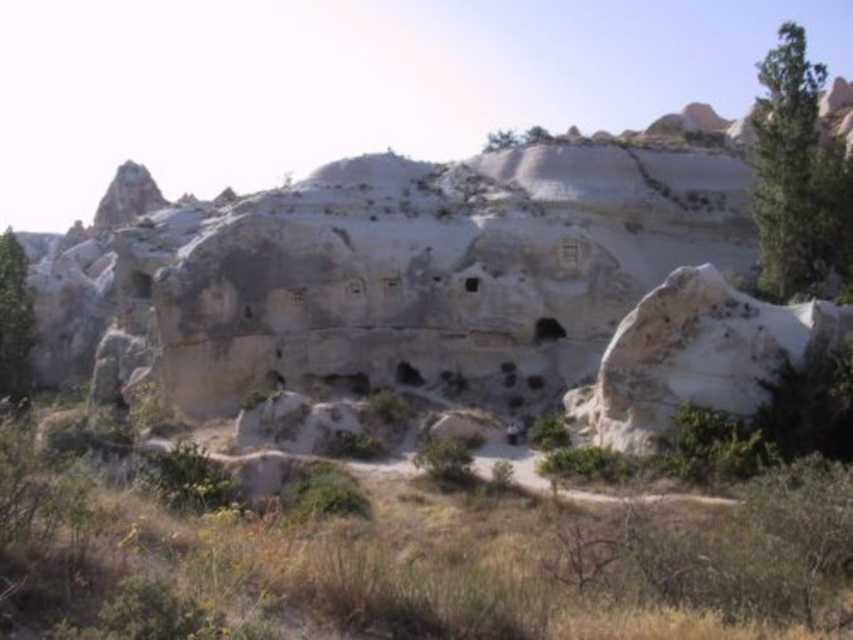
Who is positioned more to the left, green leafy tree at upper right or green leafy bush at center?

Positioned to the left is green leafy bush at center.

Is green leafy tree at upper right smaller than green leafy bush at center?

No.

Locate an element on the screen. The image size is (853, 640). green leafy tree at upper right is located at coordinates point(798,177).

Locate an element on the screen. This screenshot has width=853, height=640. green leafy tree at upper right is located at coordinates (798, 177).

Does point (587, 198) lie behind point (416, 449)?

Yes, point (587, 198) is farther from viewer.

Between point (442, 200) and point (463, 444), which one is positioned in front?

Point (463, 444) is in front.

Who is more distant from viewer, (428, 356) or (416, 456)?

Point (428, 356)

Where is `white rock formation at center`? This screenshot has width=853, height=640. white rock formation at center is located at coordinates (383, 269).

Does green leafy tree at upper right have a lesser width compared to green leafy tree at left?

In fact, green leafy tree at upper right might be wider than green leafy tree at left.

Is point (813, 122) closer to viewer compared to point (25, 355)?

Yes, it is.

Is point (785, 291) in front of point (3, 305)?

That is True.

The width and height of the screenshot is (853, 640). Identify the location of green leafy tree at upper right. pyautogui.click(x=798, y=177).